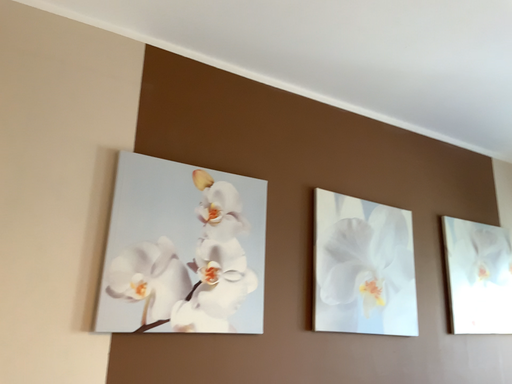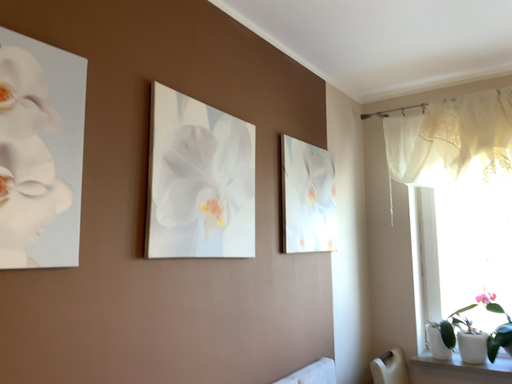
Question: Which way did the camera rotate in the video?

Choices:
 (A) rotated downward
 (B) rotated upward

Answer: (A)